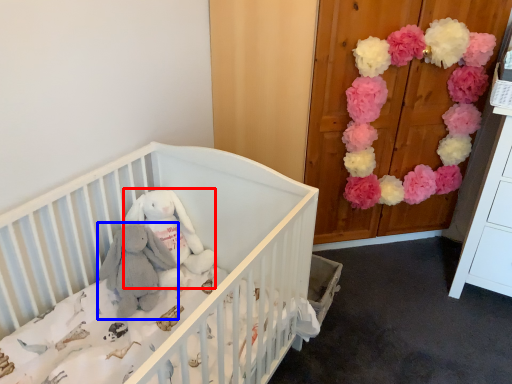
Question: Which of the following is the closest to the observer, toy (highlighted by a red box) or baby elephant (highlighted by a blue box)?

Choices:
 (A) toy
 (B) baby elephant

Answer: (B)